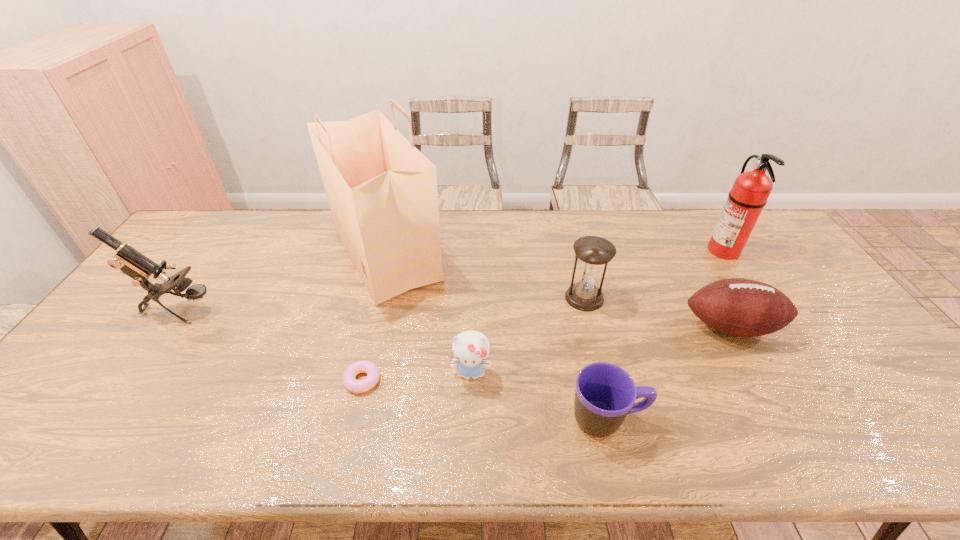
Locate an element on the screen. Image resolution: width=960 pixels, height=540 pixels. empty space that is in between the third tallest object and the tallest object is located at coordinates (283, 282).

Find the location of a particular element. This screenshot has height=540, width=960. free area in between the tallest object and the fire extinguisher is located at coordinates (555, 252).

Identify the location of vacant space in between the leftmost object and the hourglass. (382, 304).

Where is `vacant space that is in between the tallest object and the football (American)`? vacant space that is in between the tallest object and the football (American) is located at coordinates (559, 291).

Locate an element on the screen. vacant space that is in between the tallest object and the fire extinguisher is located at coordinates coord(555,252).

This screenshot has height=540, width=960. I want to click on free space between the hourglass and the fourth object from left to right, so click(x=527, y=335).

Where is `object identified as the third closest to the tallest object`? Image resolution: width=960 pixels, height=540 pixels. object identified as the third closest to the tallest object is located at coordinates (137, 266).

Locate an element on the screen. the fourth closest object to the seventh shortest object is located at coordinates (471, 348).

What are the coordinates of `free point that satisfies the following two spatial constraints: 1. on the side of the football (American) with the superhero design; 2. on the left side of the tallest object` in the screenshot? It's located at (368, 327).

Find the location of `free space that satisfies the following two spatial constraints: 1. on the side of the football (American) with the superhero design; 2. on the left side of the grocery bag`. free space that satisfies the following two spatial constraints: 1. on the side of the football (American) with the superhero design; 2. on the left side of the grocery bag is located at coordinates (368, 327).